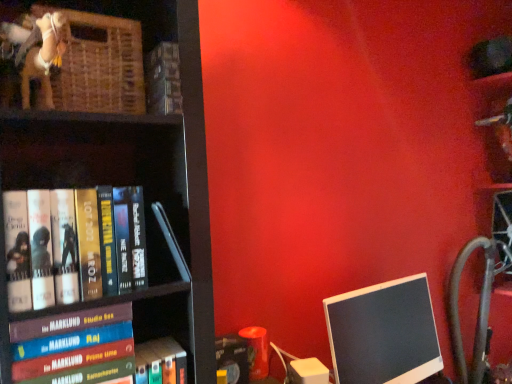
Question: Is black plastic monitor at right taller or shorter than matte black book at lower center, acting as the 5th book starting from the top?

Choices:
 (A) tall
 (B) short

Answer: (A)

Question: Relative to matte black book at lower center, the first book when ordered from bottom to top, is black plastic monitor at right in front or behind?

Choices:
 (A) front
 (B) behind

Answer: (B)

Question: Which object is the closest to the hardcover book at left, marked as the second book in a top-to-bottom arrangement?

Choices:
 (A) hardcover book at lower left, the 2th book from the bottom
 (B) black plastic monitor at right
 (C) hardcover book at left, marked as the third book in a bottom-to-top arrangement
 (D) hardcover book at upper center, arranged as the first book when viewed from the top
 (E) woven wood basket at upper left

Answer: (C)

Question: Which object is the farthest from the matte black book at lower center, the first book when ordered from bottom to top?

Choices:
 (A) woven wood basket at upper left
 (B) hardcover book at lower left, which is counted as the fourth book, starting from the top
 (C) hardcover book at left, which is the 3th book from top to bottom
 (D) hardcover book at upper center, the fifth book in the bottom-to-top sequence
 (E) black glossy monitor at lower right

Answer: (A)